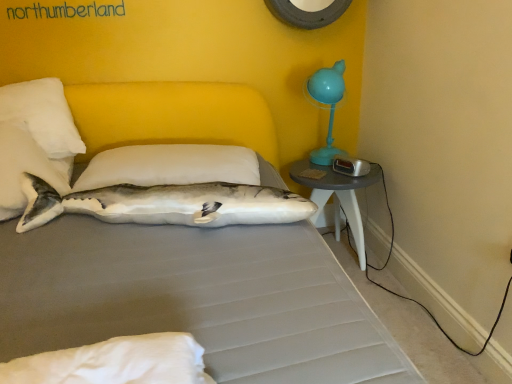
Find the location of a particular element. Image resolution: width=512 pixels, height=384 pixels. white plush shark at upper left, the 1th pillow from the left is located at coordinates (26, 167).

This screenshot has width=512, height=384. Describe the element at coordinates (166, 204) in the screenshot. I see `white fabric shark at center` at that location.

What is the approximate width of white fabric shark at center?

It is 13.20 inches.

At what (x,y) coordinates should I click in order to perform the action: click on white soft pillow at center, which is the first pillow from right to left. Please return your answer as a coordinate pair (x, y). The width and height of the screenshot is (512, 384). Looking at the image, I should click on (170, 166).

Between white plush shark at upper left, the second pillow in the right-to-left sequence, and gray plastic nightstand at right, which one has larger width?

white plush shark at upper left, the second pillow in the right-to-left sequence, is wider.

Is point (4, 135) positioned behind point (325, 198)?

No, it is not.

Where is `nightstand below the white plush shark at upper left, the 1th pillow from the left (from a real-world perspective)`? The image size is (512, 384). nightstand below the white plush shark at upper left, the 1th pillow from the left (from a real-world perspective) is located at coordinates pos(336,196).

Is white plush shark at upper left, the second pillow in the right-to-left sequence, to the right of gray plastic nightstand at right from the viewer's perspective?

No, white plush shark at upper left, the second pillow in the right-to-left sequence, is not to the right of gray plastic nightstand at right.

Does white soft pillow at center, which is the first pillow from right to left, have a lesser height compared to gray plastic nightstand at right?

Indeed, white soft pillow at center, which is the first pillow from right to left, has a lesser height compared to gray plastic nightstand at right.

In the scene shown: How much distance is there between white soft pillow at center, which is the first pillow from right to left, and gray plastic nightstand at right?

The distance of white soft pillow at center, which is the first pillow from right to left, from gray plastic nightstand at right is 24.68 inches.

Is white soft pillow at center, which is the first pillow from right to left, bigger than gray plastic nightstand at right?

No.

Is white soft pillow at center, which is the first pillow from right to left, thinner than gray plastic nightstand at right?

No, white soft pillow at center, which is the first pillow from right to left, is not thinner than gray plastic nightstand at right.

From the image's perspective, relative to white fabric shark at center, is white soft pillow at center, which is the first pillow from right to left, above or below?

white soft pillow at center, which is the first pillow from right to left, is situated higher than white fabric shark at center in the image.

In terms of size, does white soft pillow at center, which is the first pillow from right to left, appear bigger or smaller than white fabric shark at center?

Clearly, white soft pillow at center, which is the first pillow from right to left, is smaller in size than white fabric shark at center.

Is gray plastic nightstand at right positioned beyond the bounds of white fabric shark at center?

Yes, gray plastic nightstand at right is outside of white fabric shark at center.

Which of these two, gray plastic nightstand at right or white fabric shark at center, is thinner?

Thinner between the two is white fabric shark at center.

Does gray plastic nightstand at right have a greater height compared to white fabric shark at center?

Yes, gray plastic nightstand at right is taller than white fabric shark at center.

Is gray plastic nightstand at right not near white fabric shark at center?

That's not correct — gray plastic nightstand at right is a little close to white fabric shark at center.

Is white fabric shark at center wider or thinner than white soft pillow at center, arranged as the 2th pillow when viewed from the left?

In the image, white fabric shark at center appears to be more narrow than white soft pillow at center, arranged as the 2th pillow when viewed from the left.

Which is more to the right, white fabric shark at center or white soft pillow at center, which is the first pillow from right to left?

white fabric shark at center.

Considering the positions of points (47, 217) and (73, 185), is point (47, 217) closer to camera compared to point (73, 185)?

Yes, it is.

From a real-world perspective, which is physically below, white fabric shark at center or white soft pillow at center, which is the first pillow from right to left?

From a 3D spatial view, white fabric shark at center is below.

Is white plush shark at upper left, the 1th pillow from the left, at the back of gray plastic nightstand at right?

gray plastic nightstand at right is not turned away from white plush shark at upper left, the 1th pillow from the left.

From the image's perspective, would you say gray plastic nightstand at right is shown under white plush shark at upper left, the 1th pillow from the left?

Yes, from the image's perspective, gray plastic nightstand at right is below white plush shark at upper left, the 1th pillow from the left.

Considering the positions of objects white plush shark at upper left, the second pillow in the right-to-left sequence, and white fabric shark at center in the image provided, who is more to the right, white plush shark at upper left, the second pillow in the right-to-left sequence, or white fabric shark at center?

white fabric shark at center is more to the right.

Is white plush shark at upper left, the 1th pillow from the left, positioned with its back to white fabric shark at center?

No, white fabric shark at center is not at the back of white plush shark at upper left, the 1th pillow from the left.

Which of these two, white plush shark at upper left, the second pillow in the right-to-left sequence, or white fabric shark at center, is thinner?

Thinner between the two is white fabric shark at center.

Does point (3, 144) come farther from viewer compared to point (212, 203)?

Yes, point (3, 144) is behind point (212, 203).

The height and width of the screenshot is (384, 512). I want to click on nightstand that appears on the right of white plush shark at upper left, the 1th pillow from the left, so click(336, 196).

Find the location of a particular element. The width and height of the screenshot is (512, 384). pillow that is the 1st one when counting leftward from the gray plastic nightstand at right is located at coordinates [170, 166].

Which object lies further to the anchor point white soft pillow at center, which is the first pillow from right to left, white plush shark at upper left, the 1th pillow from the left, or gray plastic nightstand at right?

gray plastic nightstand at right is further to white soft pillow at center, which is the first pillow from right to left.

When comparing their distances from white soft pillow at center, which is the first pillow from right to left, does white fabric shark at center or gray plastic nightstand at right seem further?

gray plastic nightstand at right is positioned further to the anchor white soft pillow at center, which is the first pillow from right to left.

Which object lies further to the anchor point white soft pillow at center, which is the first pillow from right to left, white plush shark at upper left, the 1th pillow from the left, or white fabric shark at center?

Among the two, white plush shark at upper left, the 1th pillow from the left, is located further to white soft pillow at center, which is the first pillow from right to left.

Looking at this image, from the image, which object appears to be nearer to gray plastic nightstand at right, white plush shark at upper left, the second pillow in the right-to-left sequence, or white fabric shark at center?

white fabric shark at center lies closer to gray plastic nightstand at right than the other object.

Looking at the image, which one is located closer to gray plastic nightstand at right, white fabric shark at center or white plush shark at upper left, the 1th pillow from the left?

white fabric shark at center is positioned closer to the anchor gray plastic nightstand at right.

When comparing their distances from white fabric shark at center, does white soft pillow at center, arranged as the 2th pillow when viewed from the left, or gray plastic nightstand at right seem further?

The object further to white fabric shark at center is gray plastic nightstand at right.

Which object lies nearer to the anchor point gray plastic nightstand at right, white plush shark at upper left, the 1th pillow from the left, or white soft pillow at center, arranged as the 2th pillow when viewed from the left?

white soft pillow at center, arranged as the 2th pillow when viewed from the left.

Estimate the real-world distances between objects in this image. Which object is further from white plush shark at upper left, the 1th pillow from the left, white fabric shark at center or white soft pillow at center, arranged as the 2th pillow when viewed from the left?

The object further to white plush shark at upper left, the 1th pillow from the left, is white soft pillow at center, arranged as the 2th pillow when viewed from the left.

Where is `shark between white soft pillow at center, which is the first pillow from right to left, and gray plastic nightstand at right from left to right`? The image size is (512, 384). shark between white soft pillow at center, which is the first pillow from right to left, and gray plastic nightstand at right from left to right is located at coordinates (166, 204).

Find the location of a particular element. The width and height of the screenshot is (512, 384). pillow between white plush shark at upper left, the second pillow in the right-to-left sequence, and white fabric shark at center, in the horizontal direction is located at coordinates (170, 166).

This screenshot has height=384, width=512. Identify the location of shark between white plush shark at upper left, the second pillow in the right-to-left sequence, and gray plastic nightstand at right, in the horizontal direction. (166, 204).

The height and width of the screenshot is (384, 512). I want to click on pillow between white plush shark at upper left, the second pillow in the right-to-left sequence, and gray plastic nightstand at right, so click(170, 166).